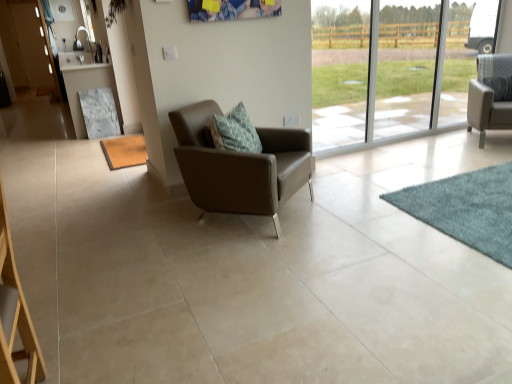
Question: From the image's perspective, relative to brown leather armchair at center, the first chair viewed from the front, is matte wood screen door at upper left above or below?

Choices:
 (A) below
 (B) above

Answer: (B)

Question: From their relative heights in the image, would you say matte wood screen door at upper left is taller or shorter than brown leather armchair at center, the first chair viewed from the front?

Choices:
 (A) short
 (B) tall

Answer: (B)

Question: Considering the real-world distances, which object is closest to the matte gray armchair at right, the second chair viewed from the front?

Choices:
 (A) matte wood screen door at upper left
 (B) marble table at left
 (C) brown leather armchair at center, the second chair viewed from the right
 (D) transparent glass window at right
 (E) teal carpet at lower right, which ranks as the first mat in right-to-left order

Answer: (D)

Question: Which of these objects is positioned closest to the brown leather armchair at center, arranged as the 1th chair when viewed from the left?

Choices:
 (A) teal carpet at lower right, the 2th mat from the back
 (B) marble table at left
 (C) transparent glass window at right
 (D) matte gray armchair at right, which appears as the second chair when viewed from the left
 (E) brown textured mat at lower left, arranged as the 1th mat when viewed from the back

Answer: (A)